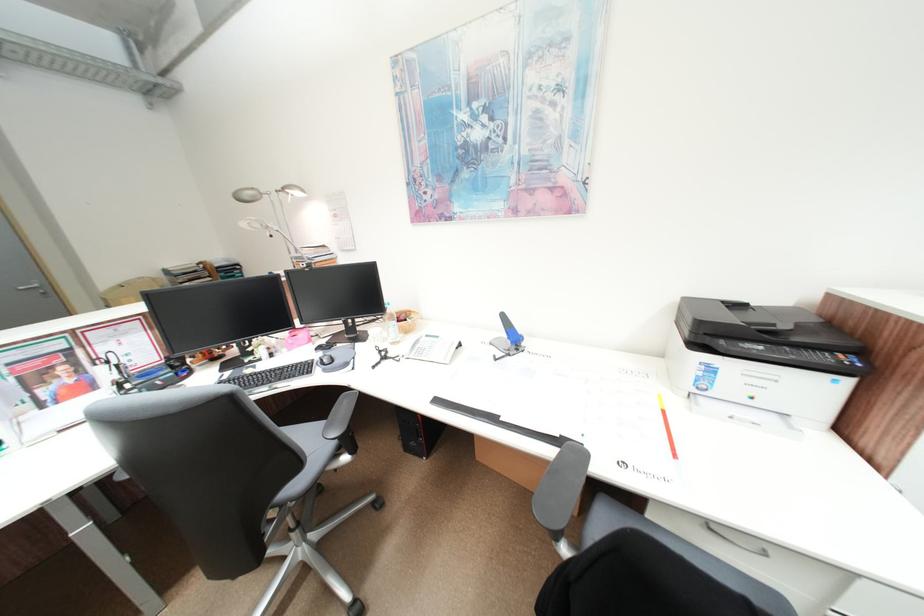
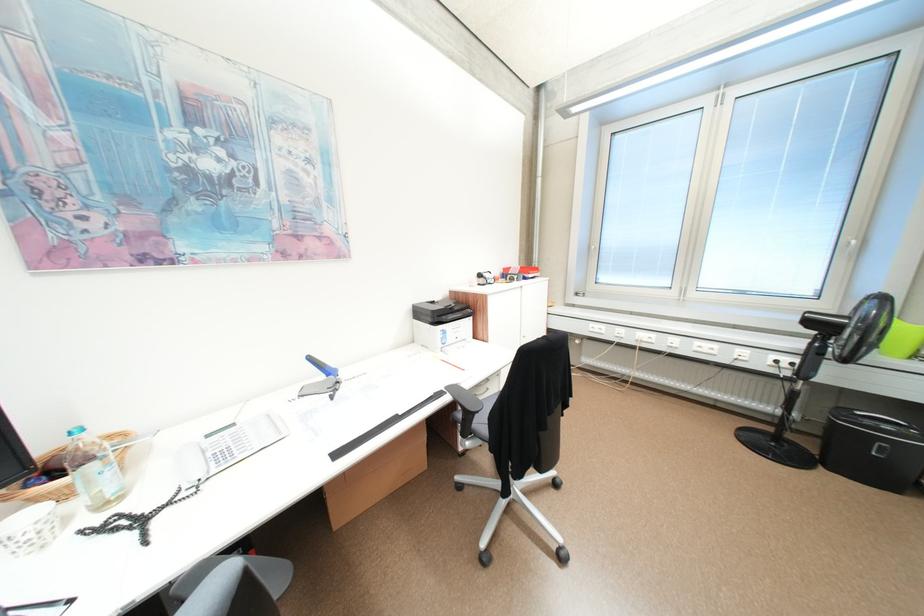
Find the pixel in the second image that matches [513,315] in the first image.

(320, 359)